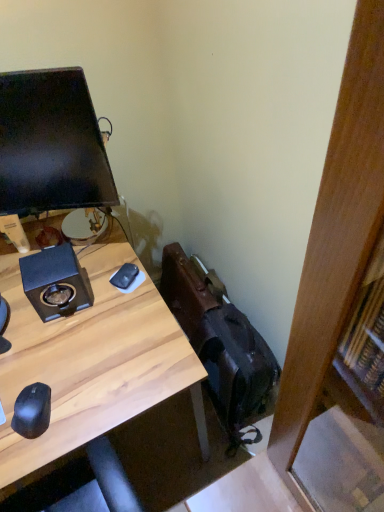
Where is `wooden desk at center`? wooden desk at center is located at coordinates (91, 362).

The image size is (384, 512). What do you see at coordinates (56, 282) in the screenshot?
I see `black matte speaker at upper left` at bounding box center [56, 282].

Measure the distance between point [25,426] and camera.

Point [25,426] is 94.80 centimeters away from camera.

What is the approximate width of black matte mouse at center, the second mouse viewed from the left?

It is 10.46 centimeters.

In order to face matte black monitor at upper left, should I rotate leftwards or rightwards?

You should rotate left by 20.228 degrees.

Where is `wooden desk at center`? This screenshot has height=512, width=384. wooden desk at center is located at coordinates (91, 362).

Find the location of a particular element. mouse lying above the black matte speaker at upper left (from the image's perspective) is located at coordinates (125, 276).

Is black matte speaker at upper left not near black matte mouse at center, the 2th mouse positioned from the front?

No, black matte speaker at upper left is not far away from black matte mouse at center, the 2th mouse positioned from the front.

Is black matte speaker at upper left thinner than black matte mouse at center, the second mouse viewed from the left?

In fact, black matte speaker at upper left might be wider than black matte mouse at center, the second mouse viewed from the left.

Can you confirm if black matte speaker at upper left is shorter than black matte mouse at center, the first mouse when ordered from top to bottom?

No.

Is black matte mouse at center, the second mouse viewed from the left, touching black matte speaker at upper left?

No, black matte mouse at center, the second mouse viewed from the left, is not touching black matte speaker at upper left.

From the image's perspective, is black matte mouse at center, which is counted as the second mouse, starting from the bottom, positioned above or below black matte speaker at upper left?

black matte mouse at center, which is counted as the second mouse, starting from the bottom, is situated higher than black matte speaker at upper left in the image.

The height and width of the screenshot is (512, 384). I want to click on mouse that is the 2nd object directly below the black matte speaker at upper left (from a real-world perspective), so click(125, 276).

Which is more distant, (129,264) or (76,269)?

Positioned behind is point (129,264).

In the scene shown: Would you consider matte black monitor at upper left to be distant from wooden desk at center?

No, matte black monitor at upper left is in close proximity to wooden desk at center.

Choose the correct answer: Is matte black monitor at upper left inside wooden desk at center or outside it?

matte black monitor at upper left cannot be found inside wooden desk at center.

From a real-world perspective, who is located lower, matte black monitor at upper left or wooden desk at center?

wooden desk at center is physically lower.

What are the coordinates of `computer monitor behind the wooden desk at center` in the screenshot? It's located at (51, 144).

The width and height of the screenshot is (384, 512). Find the location of `mouse on the left of the black matte speaker at upper left`. mouse on the left of the black matte speaker at upper left is located at coordinates (32, 411).

Which of these two, black matte mouse at lower left, arranged as the 2th mouse when viewed from the right, or black matte speaker at upper left, is wider?

With larger width is black matte speaker at upper left.

Considering the points (46, 400) and (31, 290), which point is in front, point (46, 400) or point (31, 290)?

Positioned in front is point (46, 400).

Is matte black monitor at upper left not close to black matte mouse at center, the 1th mouse from the right?

matte black monitor at upper left is actually quite close to black matte mouse at center, the 1th mouse from the right.

Consider the image. Who is bigger, matte black monitor at upper left or black matte mouse at center, the 1th mouse from the right?

matte black monitor at upper left is bigger.

This screenshot has width=384, height=512. In order to click on computer monitor above the black matte mouse at center, the 1th mouse from the right (from a real-world perspective) in this screenshot , I will do `click(51, 144)`.

From a real-world perspective, is matte black monitor at upper left physically above black matte mouse at center, the first mouse when ordered from top to bottom?

Correct, in the physical world, matte black monitor at upper left is higher than black matte mouse at center, the first mouse when ordered from top to bottom.

In the scene shown: From a real-world perspective, is matte black monitor at upper left on black matte mouse at lower left, arranged as the first mouse when viewed from the left?

Correct, in the physical world, matte black monitor at upper left is higher than black matte mouse at lower left, arranged as the first mouse when viewed from the left.

Which object is more forward, matte black monitor at upper left or black matte mouse at lower left, the second mouse when ordered from back to front?

matte black monitor at upper left is more forward.

Is matte black monitor at upper left positioned beyond the bounds of black matte mouse at lower left, the second mouse viewed from the top?

Yes, matte black monitor at upper left is not within black matte mouse at lower left, the second mouse viewed from the top.

The width and height of the screenshot is (384, 512). Find the location of `desk on the left of black matte mouse at center, the first mouse when ordered from top to bottom`. desk on the left of black matte mouse at center, the first mouse when ordered from top to bottom is located at coordinates (91, 362).

Is wooden desk at center completely or partially inside black matte mouse at center, the 1th mouse from the right?

No.

From the image's perspective, between black matte mouse at center, the second mouse viewed from the left, and wooden desk at center, which one is located above?

black matte mouse at center, the second mouse viewed from the left, appears higher in the image.

Considering the positions of objects black matte mouse at center, the 2th mouse positioned from the front, and wooden desk at center in the image provided, who is in front, black matte mouse at center, the 2th mouse positioned from the front, or wooden desk at center?

wooden desk at center is more forward.

Where is `speaker above the black matte mouse at center, the 1th mouse from the right (from a real-world perspective)`? speaker above the black matte mouse at center, the 1th mouse from the right (from a real-world perspective) is located at coordinates (x=56, y=282).

In the image, there is a black matte mouse at center, the second mouse viewed from the left. Where is `speaker below it (from the image's perspective)`? speaker below it (from the image's perspective) is located at coordinates (56, 282).

Considering their positions, is matte black monitor at upper left positioned further to black matte mouse at center, the second mouse viewed from the left, than wooden desk at center?

matte black monitor at upper left lies further to black matte mouse at center, the second mouse viewed from the left, than the other object.

Based on their spatial positions, is black matte mouse at center, the second mouse viewed from the left, or wooden desk at center closer to black matte speaker at upper left?

wooden desk at center is positioned closer to the anchor black matte speaker at upper left.

Based on the photo, looking at the image, which one is located closer to matte black monitor at upper left, wooden desk at center or black matte mouse at lower left, the second mouse viewed from the top?

wooden desk at center.

Based on their spatial positions, is wooden desk at center or black matte mouse at lower left, arranged as the 2th mouse when viewed from the right, further from black matte mouse at center, the 1th mouse from the right?

black matte mouse at lower left, arranged as the 2th mouse when viewed from the right, is positioned further to the anchor black matte mouse at center, the 1th mouse from the right.

Looking at the image, which one is located further to matte black monitor at upper left, wooden desk at center or black matte mouse at center, which is counted as the second mouse, starting from the bottom?

black matte mouse at center, which is counted as the second mouse, starting from the bottom, is positioned further to the anchor matte black monitor at upper left.

Looking at the image, which one is located closer to black matte speaker at upper left, wooden desk at center or black matte mouse at lower left, which is the first mouse from bottom to top?

wooden desk at center.

Looking at the image, which one is located closer to black matte speaker at upper left, black matte mouse at center, placed as the first mouse when sorted from back to front, or black matte mouse at lower left, which is the 1th mouse in front-to-back order?

black matte mouse at center, placed as the first mouse when sorted from back to front, is closer to black matte speaker at upper left.

Which object lies nearer to the anchor point matte black monitor at upper left, black matte mouse at lower left, which is the first mouse from bottom to top, or black matte mouse at center, which is counted as the second mouse, starting from the bottom?

Among the two, black matte mouse at center, which is counted as the second mouse, starting from the bottom, is located nearer to matte black monitor at upper left.

Identify the location of speaker between black matte mouse at center, placed as the first mouse when sorted from back to front, and black matte mouse at lower left, which is the 1th mouse in front-to-back order, from top to bottom. Image resolution: width=384 pixels, height=512 pixels. (56, 282).

The height and width of the screenshot is (512, 384). Identify the location of mouse between matte black monitor at upper left and black matte speaker at upper left in the up-down direction. (125, 276).

Identify the location of mouse between black matte speaker at upper left and wooden desk at center from top to bottom. This screenshot has width=384, height=512. (32, 411).

Find the location of a particular element. The height and width of the screenshot is (512, 384). speaker between matte black monitor at upper left and wooden desk at center in the up-down direction is located at coordinates (56, 282).